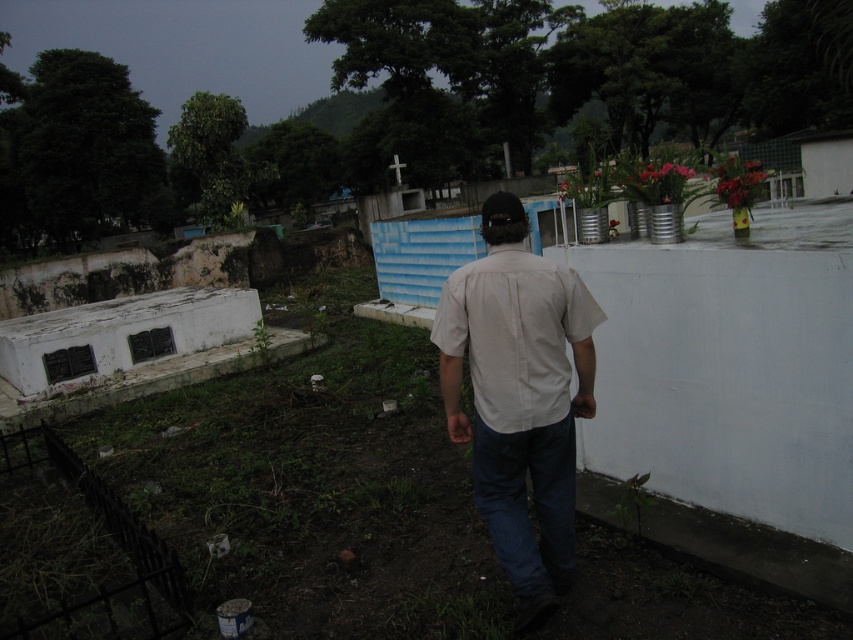
You are a photographer trying to capture a candid shot of the man in the cemetery. You need to ensure that both the white cotton shirt at center and the denim at lower center are in focus. Given that your camera can only focus on objects within a 15 inch range, will both items be in focus?

The white cotton shirt at center and denim at lower center are 15.35 inches apart. Since the distance between them exceeds the camera focus range of 15 inches, both items cannot be in focus simultaneously.

You are a photographer trying to capture both the white matte shirt at center and the white cotton shirt at center in a single frame. Since you want to emphasize the size difference between them, which one should you position closer to the camera?

To emphasize the size difference between the white matte shirt at center and the white cotton shirt at center, you should position the white matte shirt at center closer to the camera since it is larger in size.